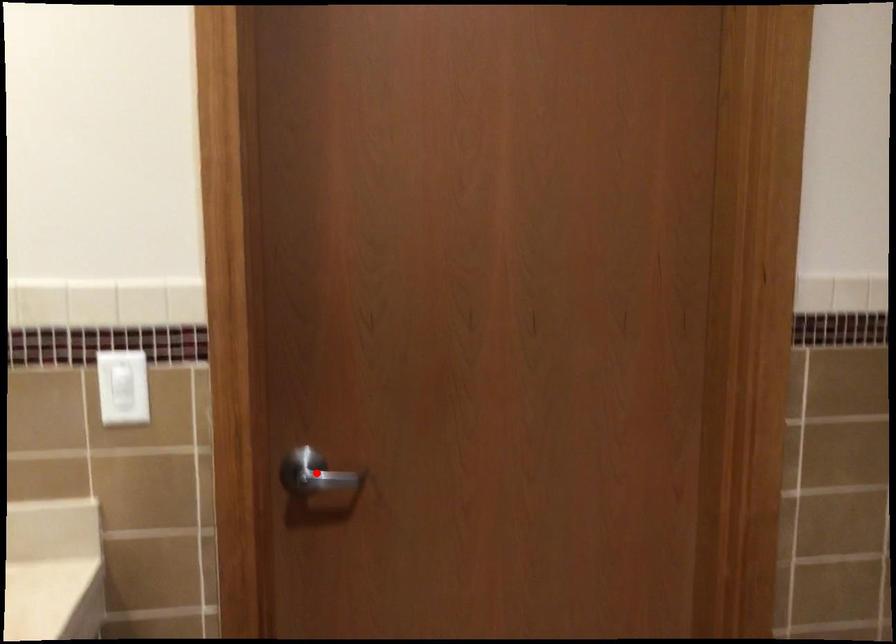
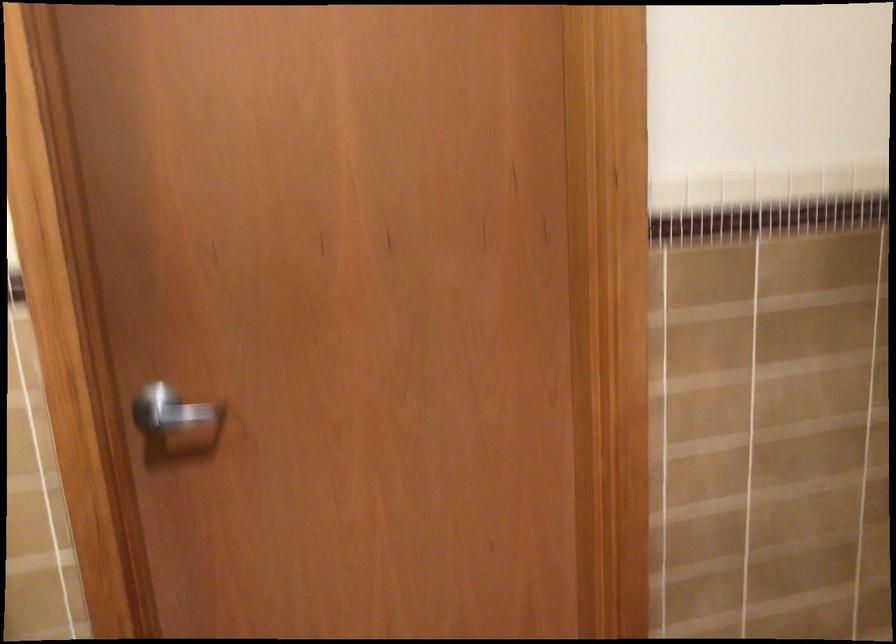
Where in the second image is the point corresponding to the highlighted location from the first image?

(170, 412)